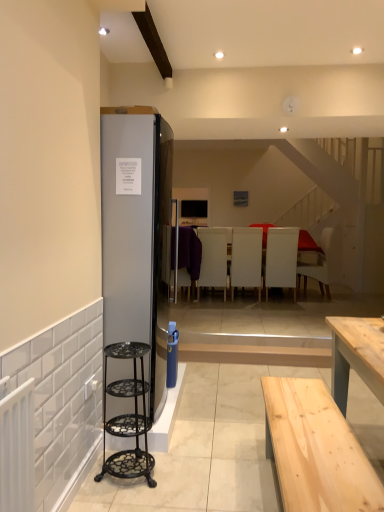
Question: Which direction should I rotate to look at white leather armchair at center, the second armchair positioned from the right, — up or down?

Choices:
 (A) up
 (B) down

Answer: (B)

Question: Does white leather armchair at center, the third armchair from the left, have a greater width compared to satin silver refrigerator at left?

Choices:
 (A) no
 (B) yes

Answer: (A)

Question: Is white leather armchair at center, the 3th armchair in the right-to-left sequence, at the left side of satin silver refrigerator at left?

Choices:
 (A) no
 (B) yes

Answer: (A)

Question: From the image's perspective, is white leather armchair at center, the 3th armchair in the right-to-left sequence, on satin silver refrigerator at left?

Choices:
 (A) yes
 (B) no

Answer: (B)

Question: Can you confirm if white leather armchair at center, the third armchair from the left, is shorter than satin silver refrigerator at left?

Choices:
 (A) no
 (B) yes

Answer: (B)

Question: From a real-world perspective, is white leather armchair at center, the 3th armchair in the right-to-left sequence, beneath satin silver refrigerator at left?

Choices:
 (A) no
 (B) yes

Answer: (B)

Question: Is white leather armchair at center, the third armchair from the left, far from satin silver refrigerator at left?

Choices:
 (A) yes
 (B) no

Answer: (A)

Question: From the image's perspective, would you say white leather armchair at center, the third armchair from the left, is positioned over white leather armchair at center, the second armchair positioned from the right?

Choices:
 (A) no
 (B) yes

Answer: (B)

Question: Considering the relative sizes of white leather armchair at center, the 3th armchair in the right-to-left sequence, and white leather armchair at center, the second armchair positioned from the right, in the image provided, is white leather armchair at center, the 3th armchair in the right-to-left sequence, thinner than white leather armchair at center, the second armchair positioned from the right,?

Choices:
 (A) yes
 (B) no

Answer: (B)

Question: Is white leather armchair at center, the 3th armchair in the right-to-left sequence, turned away from white leather armchair at center, which appears as the fourth armchair when viewed from the left?

Choices:
 (A) yes
 (B) no

Answer: (B)

Question: Considering the relative sizes of white leather armchair at center, the 3th armchair in the right-to-left sequence, and white leather armchair at center, the second armchair positioned from the right, in the image provided, is white leather armchair at center, the 3th armchair in the right-to-left sequence, shorter than white leather armchair at center, the second armchair positioned from the right,?

Choices:
 (A) no
 (B) yes

Answer: (B)

Question: Is white leather armchair at center, the third armchair from the left, positioned behind white leather armchair at center, which appears as the fourth armchair when viewed from the left?

Choices:
 (A) yes
 (B) no

Answer: (A)

Question: Considering the relative sizes of purple fabric armchair at center, the first armchair viewed from the left, and white leather armchair at center, the third armchair from the left, in the image provided, is purple fabric armchair at center, the first armchair viewed from the left, bigger than white leather armchair at center, the third armchair from the left,?

Choices:
 (A) yes
 (B) no

Answer: (B)